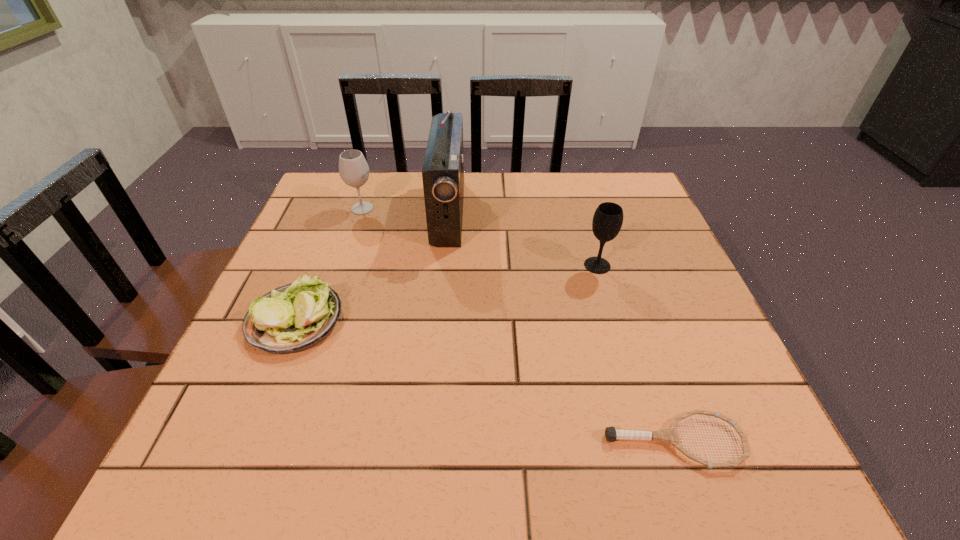
Image resolution: width=960 pixels, height=540 pixels. Find the location of `vacant space that is in between the lettuce and the nearest object`. vacant space that is in between the lettuce and the nearest object is located at coordinates (485, 380).

Locate an element on the screen. unoccupied area between the left wineglass and the nearer wineglass is located at coordinates (480, 237).

The height and width of the screenshot is (540, 960). Find the location of `vacant space that is in between the left wineglass and the lettuce`. vacant space that is in between the left wineglass and the lettuce is located at coordinates (329, 264).

This screenshot has height=540, width=960. Find the location of `blank region between the right wineglass and the tennis racket`. blank region between the right wineglass and the tennis racket is located at coordinates (636, 354).

The height and width of the screenshot is (540, 960). What are the coordinates of `vacant area between the lettuce and the third object from right to left` in the screenshot? It's located at (372, 266).

Where is `vacant region between the shortest object and the third object from left to right`? vacant region between the shortest object and the third object from left to right is located at coordinates (562, 327).

The width and height of the screenshot is (960, 540). What are the coordinates of `free spot between the right wineglass and the fourth tallest object` in the screenshot? It's located at (446, 292).

The image size is (960, 540). What are the coordinates of `vacant area between the fourth tallest object and the tallest object` in the screenshot? It's located at (372, 266).

You are a GUI agent. You are given a task and a screenshot of the screen. Output one action in this format:
    pyautogui.click(x=<x>, y=<y>)
    Task: Click on the object that ranks as the third closest to the left wineglass
    
    Given the screenshot: What is the action you would take?
    pyautogui.click(x=607, y=221)

Locate an element on the screen. This screenshot has width=960, height=540. the closest object to the second shortest object is located at coordinates (443, 170).